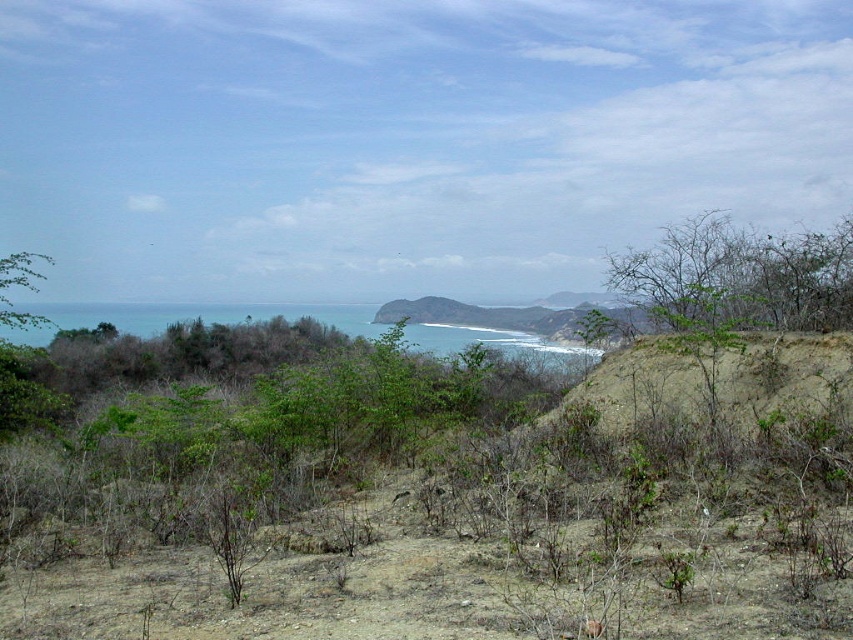
You are standing on the sandy terrain in the coastal landscape. You want to reach the blue water at center. Which direction should you move to get there?

The blue water at center is located at point coordinates of 0.497 on the x axis and 0.223 on the y axis. Since you are on the sandy terrain in the foreground, you should move forward towards the center of the image to reach the blue water at center.